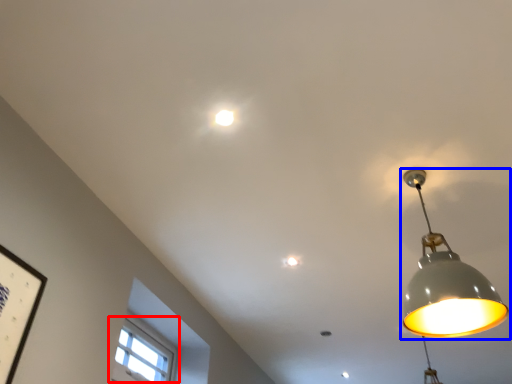
Question: Among these objects, which one is farthest to the camera, window (highlighted by a red box) or lamp (highlighted by a blue box)?

Choices:
 (A) window
 (B) lamp

Answer: (A)